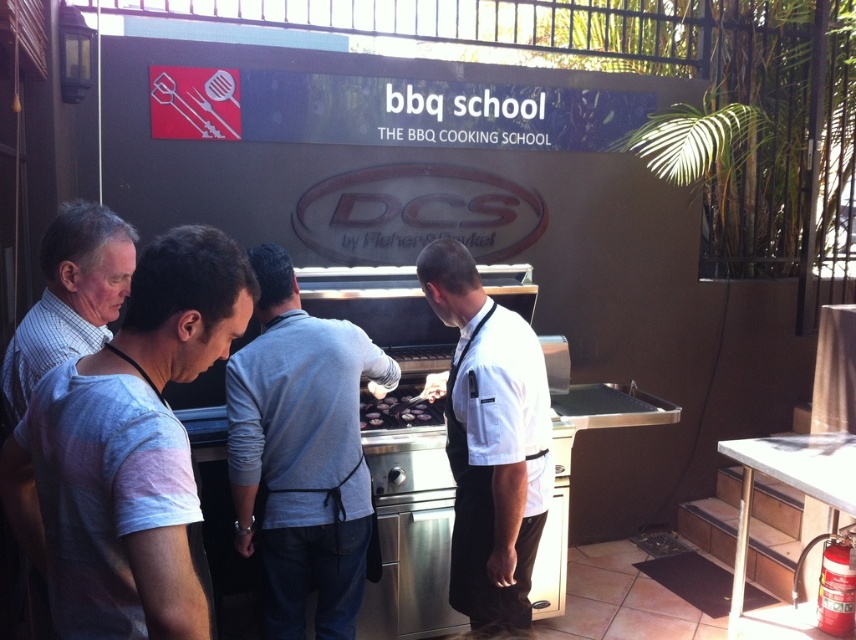
Can you confirm if gray cotton shirt at center is positioned above white matte shirt at center?

Actually, gray cotton shirt at center is below white matte shirt at center.

Does gray cotton shirt at center have a lesser height compared to white matte shirt at center?

Incorrect, gray cotton shirt at center's height does not fall short of white matte shirt at center's.

Find the location of a particular element. Image resolution: width=856 pixels, height=640 pixels. gray cotton shirt at center is located at coordinates (301, 456).

Which is below, white cotton t-shirt at center or white matte shirt at center?

Positioned lower is white matte shirt at center.

Who is higher up, white cotton t-shirt at center or white matte shirt at center?

white cotton t-shirt at center is higher up.

The width and height of the screenshot is (856, 640). Describe the element at coordinates (128, 451) in the screenshot. I see `white cotton t-shirt at center` at that location.

Identify the location of white cotton t-shirt at center. The width and height of the screenshot is (856, 640). (128, 451).

Can you confirm if white matte shirt at center is thinner than black matte grill at center?

In fact, white matte shirt at center might be wider than black matte grill at center.

Is point (504, 509) closer to camera compared to point (370, 408)?

That is True.

Where is `white matte shirt at center`? The height and width of the screenshot is (640, 856). white matte shirt at center is located at coordinates (489, 442).